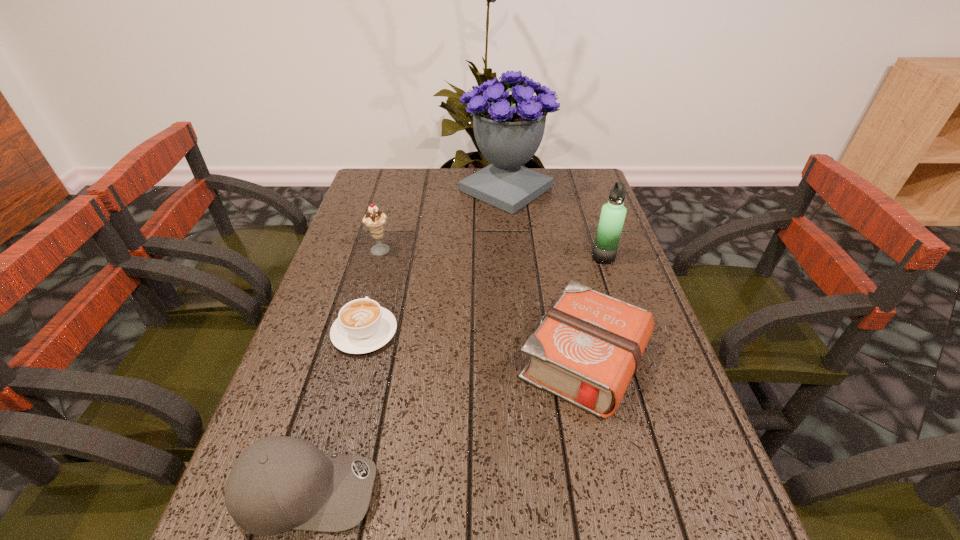
This screenshot has height=540, width=960. Find the location of `vacant space located 0.390m on the front brim of the baseball cap`. vacant space located 0.390m on the front brim of the baseball cap is located at coordinates (617, 490).

Identify the location of free region located 0.060m on the front of the Bible. (607, 456).

Locate an element on the screen. The height and width of the screenshot is (540, 960). vacant area situated 0.320m on the side of the cappuccino with the handle is located at coordinates (392, 230).

Find the location of a particular element. This screenshot has width=960, height=540. vacant space located 0.290m on the side of the cappuccino with the handle is located at coordinates (390, 236).

Locate an element on the screen. free space located on the side of the cappuccino with the handle is located at coordinates (381, 268).

The image size is (960, 540). I want to click on object located at the far edge, so (x=508, y=128).

What are the coordinates of `icecream that is at the left edge` in the screenshot? It's located at (374, 220).

I want to click on baseball cap that is at the left edge, so click(279, 483).

At what (x,y) coordinates should I click in order to perform the action: click on cappuccino located in the left edge section of the desktop. Please return your answer as a coordinate pair (x, y). The width and height of the screenshot is (960, 540). Looking at the image, I should click on (362, 326).

The width and height of the screenshot is (960, 540). Identify the location of bouquet at the right edge. (508, 128).